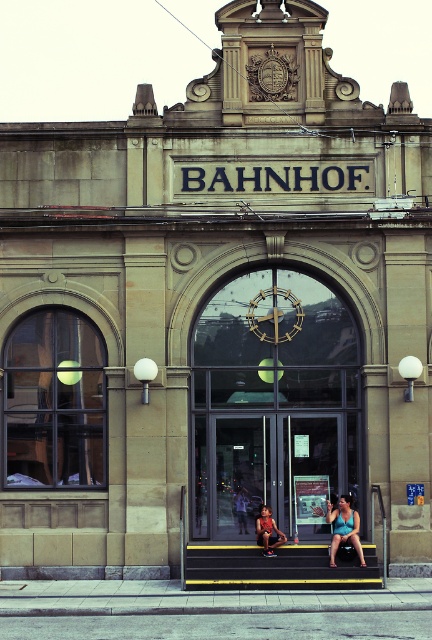
Describe the element at coordinates (267, 531) in the screenshot. This screenshot has height=640, width=432. I see `matte black shorts at center` at that location.

Between point (270, 534) and point (241, 524), which one is positioned in front?

Point (270, 534) is more forward.

The height and width of the screenshot is (640, 432). Identify the location of matte black shorts at center. (267, 531).

Measure the distance between yellow painted stairs at center and light brown leather jacket at center.

yellow painted stairs at center is 5.49 feet away from light brown leather jacket at center.

The image size is (432, 640). In order to click on yellow painted stairs at center in this screenshot , I will do point(279,566).

The width and height of the screenshot is (432, 640). What are the coordinates of `yellow painted stairs at center` in the screenshot? It's located at (279, 566).

Does matte blue tank top at center have a larger size compared to matte black shorts at center?

Indeed, matte blue tank top at center has a larger size compared to matte black shorts at center.

Does point (343, 499) come in front of point (266, 522)?

Yes, it is in front of point (266, 522).

This screenshot has width=432, height=640. Find the location of `matte blue tank top at center`. matte blue tank top at center is located at coordinates (343, 528).